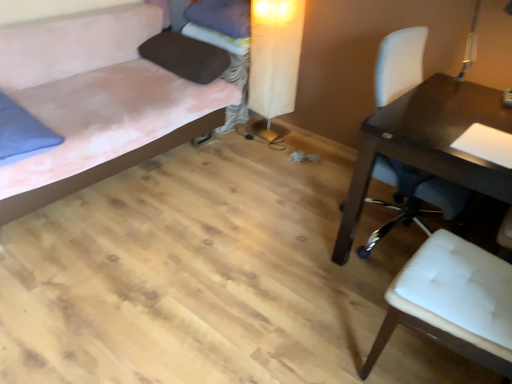
Find the location of a particular element. This screenshot has height=384, width=512. free space in front of beige fabric table lamp at center is located at coordinates (263, 149).